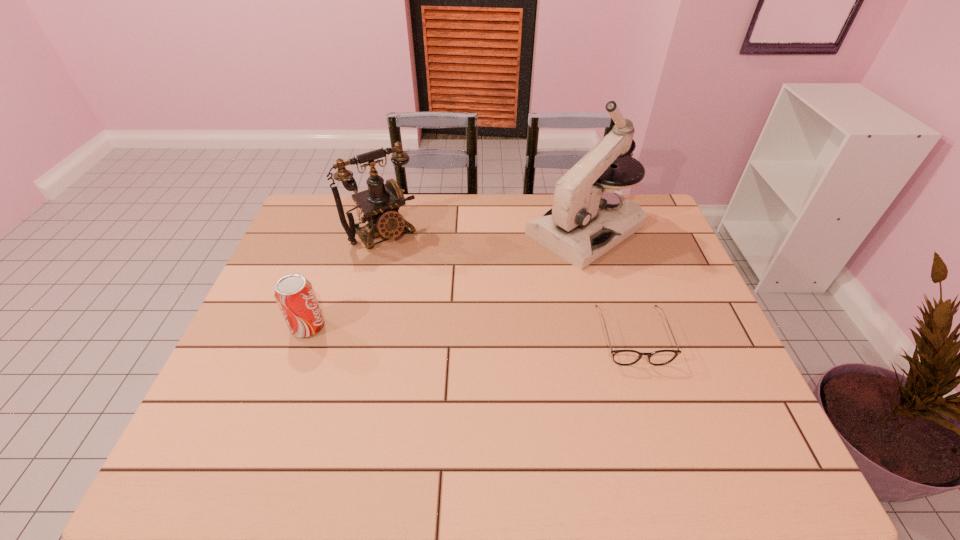
Identify the location of free space at the right edge of the desktop. (672, 248).

You are a GUI agent. You are given a task and a screenshot of the screen. Output one action in this format:
    pyautogui.click(x=<x>, y=<y>)
    Task: Click on the vacant space at the far left corner of the desktop
    
    Given the screenshot: What is the action you would take?
    click(x=351, y=207)

Identify the location of free region at the near left corner of the desktop. The height and width of the screenshot is (540, 960). (254, 391).

Find the location of a particular element. The image size is (960, 540). vacant space at the near right corner of the desktop is located at coordinates (698, 407).

This screenshot has height=540, width=960. Identify the location of vacant space in between the soda can and the third shortest object. (346, 279).

Locate an element on the screen. The height and width of the screenshot is (540, 960). vacant space that is in between the soda can and the microscope is located at coordinates (446, 279).

Where is `free space between the third tallest object and the microscope`? The height and width of the screenshot is (540, 960). free space between the third tallest object and the microscope is located at coordinates (446, 279).

The width and height of the screenshot is (960, 540). Find the location of `free space between the microscope and the second shortest object`. free space between the microscope and the second shortest object is located at coordinates (446, 279).

Where is `free space between the telephone and the third tallest object`? The height and width of the screenshot is (540, 960). free space between the telephone and the third tallest object is located at coordinates (346, 279).

Identify the location of free space between the shortest object and the soda can. This screenshot has width=960, height=540. (470, 332).